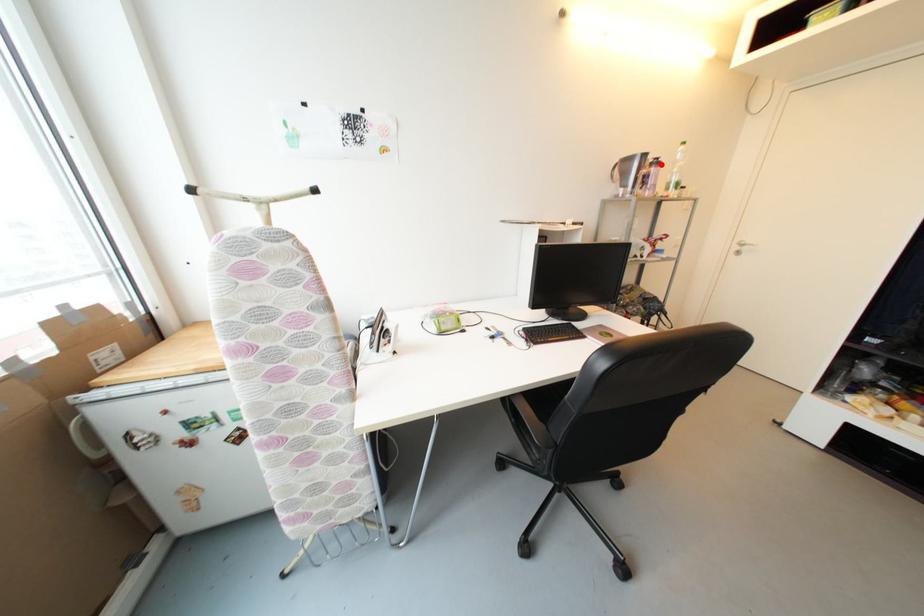
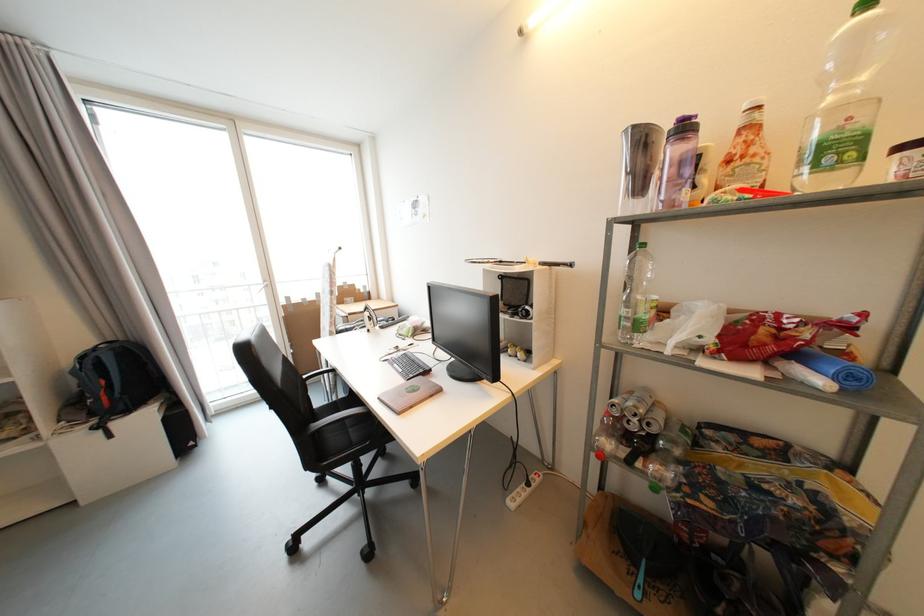
The point at the highlighted location is marked in the first image. Where is the corresponding point in the second image?

(689, 130)